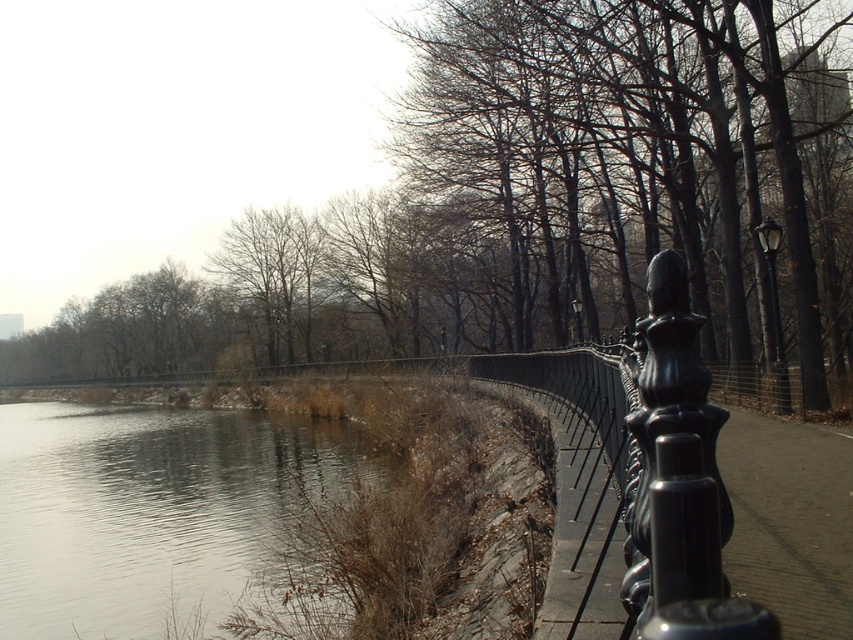
Between brown leafless tree at center and gray smooth water at lower left, which one appears on the right side from the viewer's perspective?

gray smooth water at lower left

How much distance is there between brown leafless tree at center and gray smooth water at lower left?

They are 53.11 feet apart.

Locate an element on the screen. brown leafless tree at center is located at coordinates (537, 202).

At what (x,y) coordinates should I click in order to perform the action: click on brown leafless tree at center. Please return your answer as a coordinate pair (x, y). The height and width of the screenshot is (640, 853). Looking at the image, I should click on (537, 202).